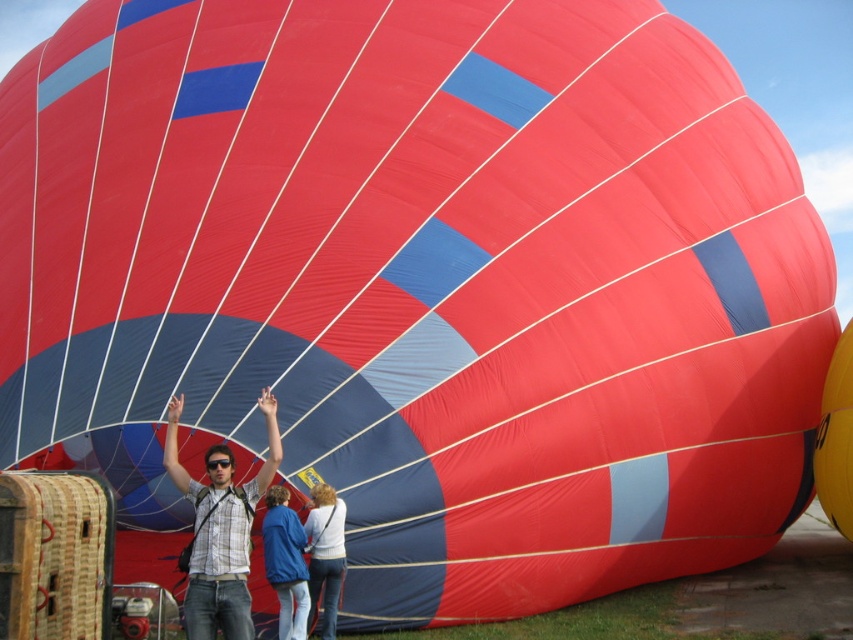
Does matte plaid shirt at center have a smaller size compared to blue fabric jacket at center?

No.

Between matte plaid shirt at center and blue fabric jacket at center, which one is positioned higher?

Positioned higher is matte plaid shirt at center.

What do you see at coordinates (219, 529) in the screenshot?
I see `matte plaid shirt at center` at bounding box center [219, 529].

This screenshot has width=853, height=640. What are the coordinates of `matte plaid shirt at center` in the screenshot? It's located at (219, 529).

Measure the distance from yellow matte balloon at center to white sweater at center.

yellow matte balloon at center and white sweater at center are 46.87 feet apart from each other.

Is yellow matte balloon at center to the left of white sweater at center from the viewer's perspective?

No, yellow matte balloon at center is not to the left of white sweater at center.

Where is `yellow matte balloon at center`? The image size is (853, 640). yellow matte balloon at center is located at coordinates (836, 438).

Identify the location of yellow matte balloon at center. (836, 438).

Does matte plaid shirt at center appear on the right side of white sweater at center?

Incorrect, matte plaid shirt at center is not on the right side of white sweater at center.

Who is taller, matte plaid shirt at center or white sweater at center?

matte plaid shirt at center is taller.

Which is behind, point (207, 595) or point (329, 513)?

Positioned behind is point (329, 513).

Where is `matte plaid shirt at center`? The height and width of the screenshot is (640, 853). matte plaid shirt at center is located at coordinates (219, 529).